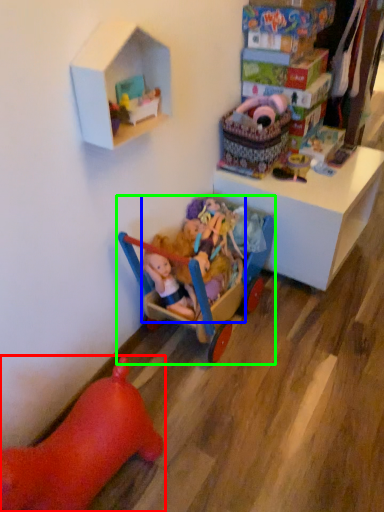
Question: Estimate the real-world distances between objects in this image. Which object is closer to toy (highlighted by a red box), toy (highlighted by a blue box) or toy (highlighted by a green box)?

Choices:
 (A) toy
 (B) toy

Answer: (B)